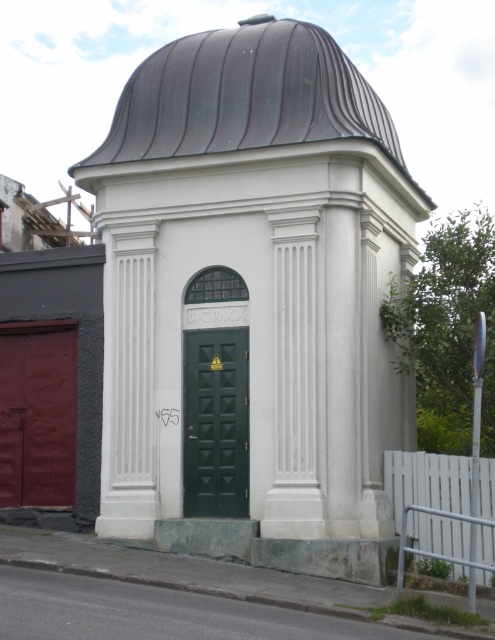
Question: Which point is farther from the camera taking this photo?

Choices:
 (A) (224, 150)
 (B) (230, 476)

Answer: (A)

Question: Which of the following is the farthest from the observer?

Choices:
 (A) white smooth chapel at center
 (B) metallic dome at center
 (C) green matte door at center

Answer: (C)

Question: Which object is positioned closest to the white smooth chapel at center?

Choices:
 (A) metallic dome at center
 (B) green matte door at center

Answer: (B)

Question: Is metallic dome at center wider than green matte door at center?

Choices:
 (A) no
 (B) yes

Answer: (B)

Question: Does white smooth chapel at center have a smaller size compared to metallic dome at center?

Choices:
 (A) no
 (B) yes

Answer: (A)

Question: Does white smooth chapel at center appear over green matte door at center?

Choices:
 (A) yes
 (B) no

Answer: (A)